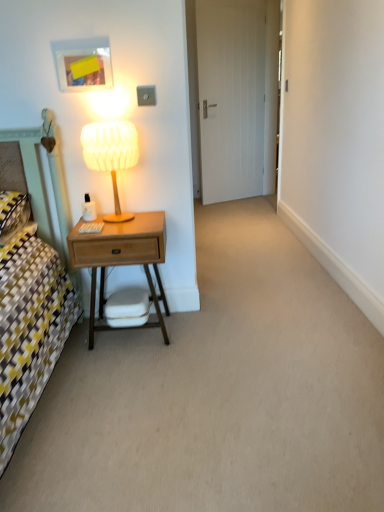
Identify the location of empty space that is ontop of wooden nightstand at left. The width and height of the screenshot is (384, 512). (120, 219).